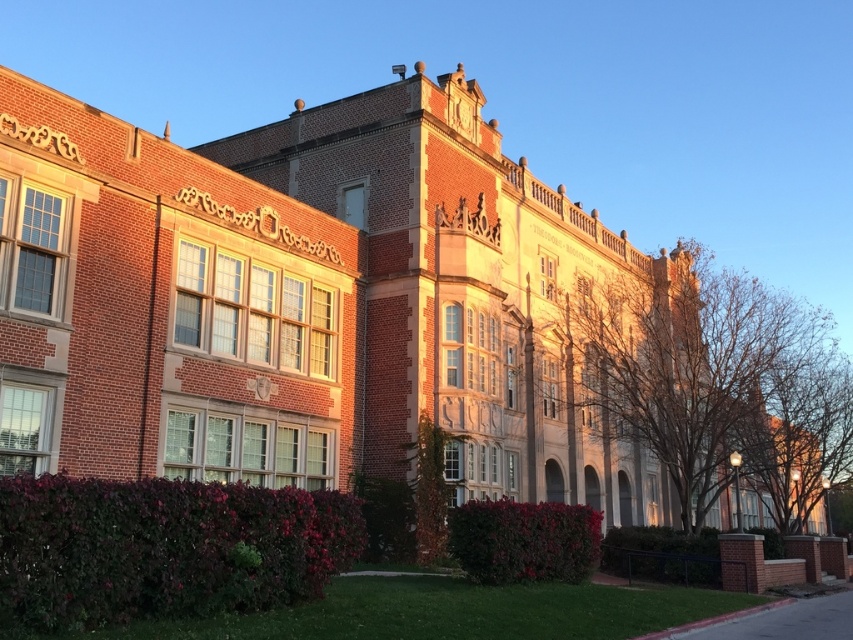
Question: Is dark green leafy hedge at lower center positioned at the back of green leafy hedge at lower center?

Choices:
 (A) no
 (B) yes

Answer: (A)

Question: Among these objects, which one is nearest to the camera?

Choices:
 (A) dark green leafy hedge at lower left
 (B) green leafy hedge at lower center
 (C) dark green leafy hedge at lower center

Answer: (A)

Question: Which object is positioned closest to the dark green leafy hedge at lower left?

Choices:
 (A) dark green leafy hedge at lower center
 (B) green leafy hedge at lower center

Answer: (A)

Question: Does dark green leafy hedge at lower center have a lesser width compared to green leafy hedge at lower center?

Choices:
 (A) yes
 (B) no

Answer: (A)

Question: Observing the image, what is the correct spatial positioning of dark green leafy hedge at lower left in reference to dark green leafy hedge at lower center?

Choices:
 (A) below
 (B) above

Answer: (B)

Question: Among these points, which one is farthest from the camera?

Choices:
 (A) (543, 524)
 (B) (16, 538)

Answer: (A)